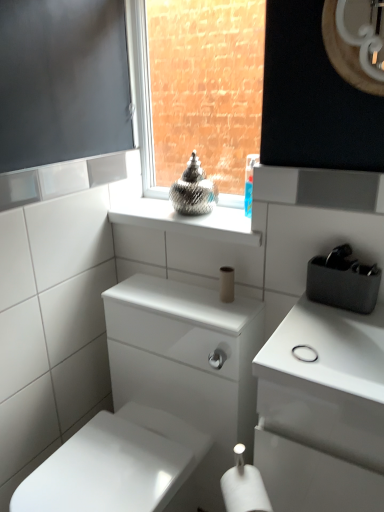
The height and width of the screenshot is (512, 384). Find the location of `free point above metallic silver vase at upper center (from a real-world perspective)`. free point above metallic silver vase at upper center (from a real-world perspective) is located at coordinates (211, 214).